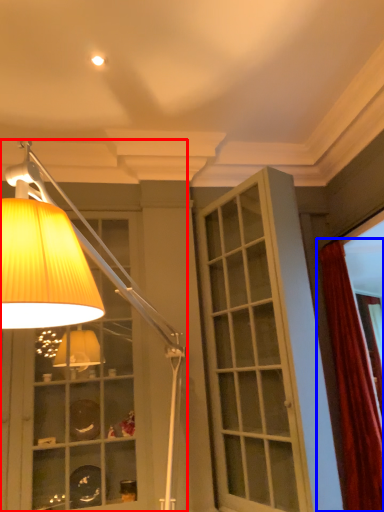
Question: Which of the following is the closest to the observer, lamp (highlighted by a red box) or curtain (highlighted by a blue box)?

Choices:
 (A) lamp
 (B) curtain

Answer: (A)